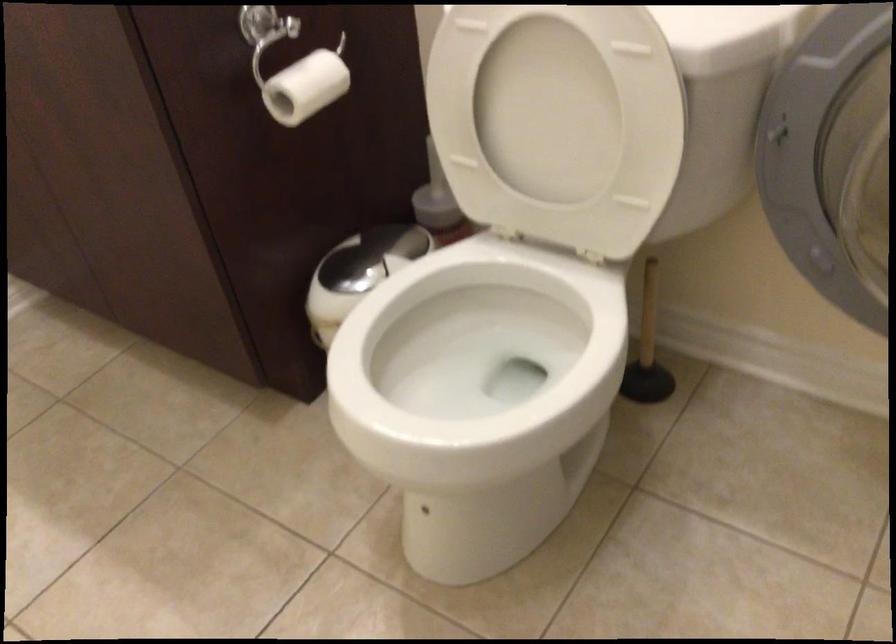
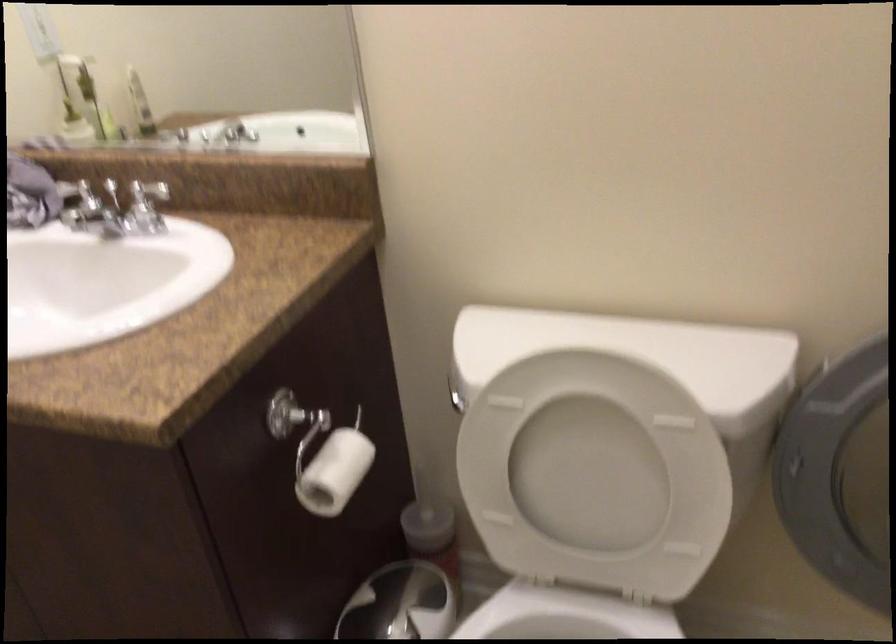
Question: In a continuous first-person perspective shot, in which direction is the camera moving?

Choices:
 (A) Left
 (B) Right
 (C) Forward
 (D) Backward

Answer: (A)